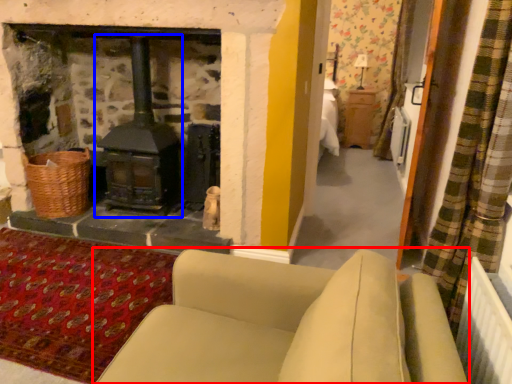
Question: Among these objects, which one is farthest to the camera, studio couch (highlighted by a red box) or wood burning stove (highlighted by a blue box)?

Choices:
 (A) studio couch
 (B) wood burning stove

Answer: (B)